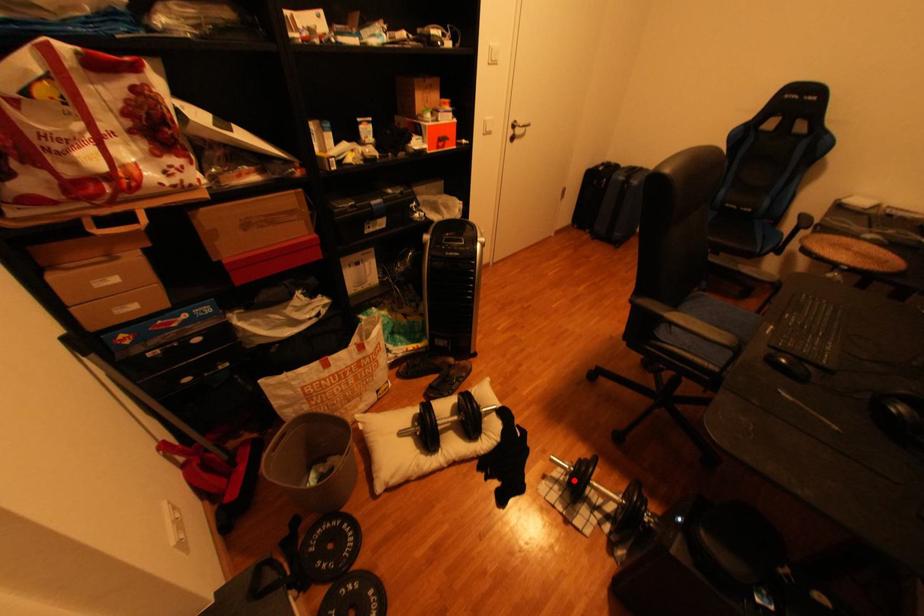
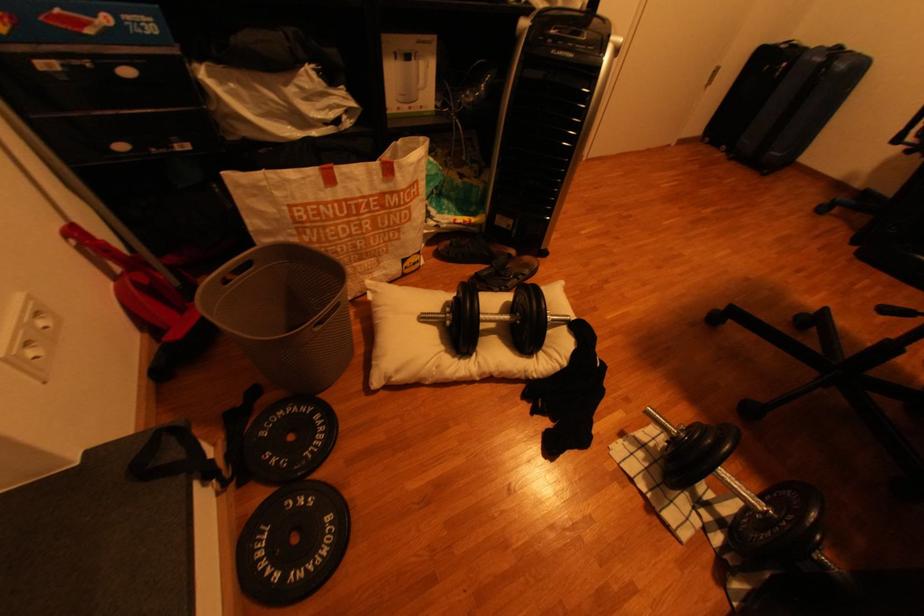
Question: I am providing you with two images of the same scene from different viewpoints. A red point is shown in image1. For the corresponding object point in image2, is it positioned nearer or farther from the camera?

Choices:
 (A) Nearer
 (B) Farther

Answer: (A)